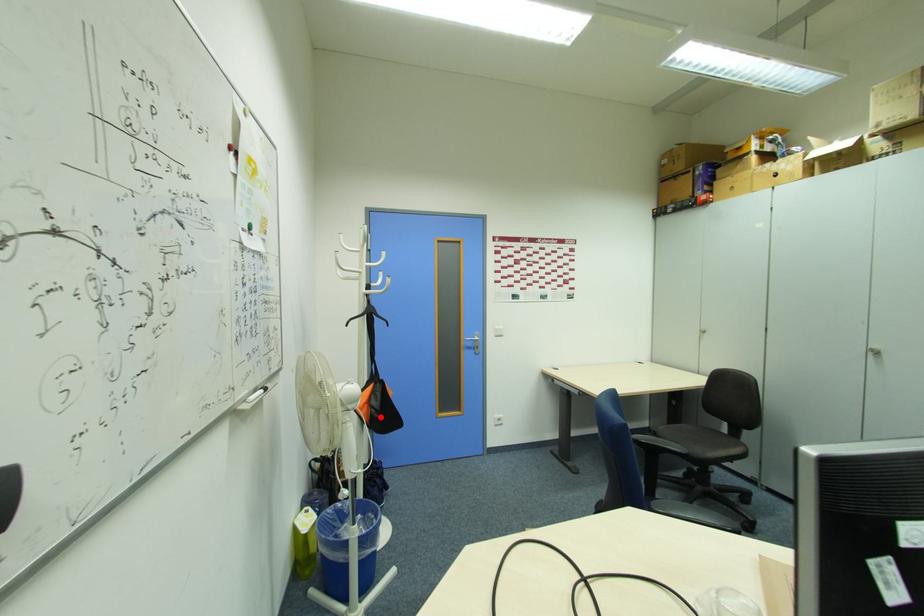
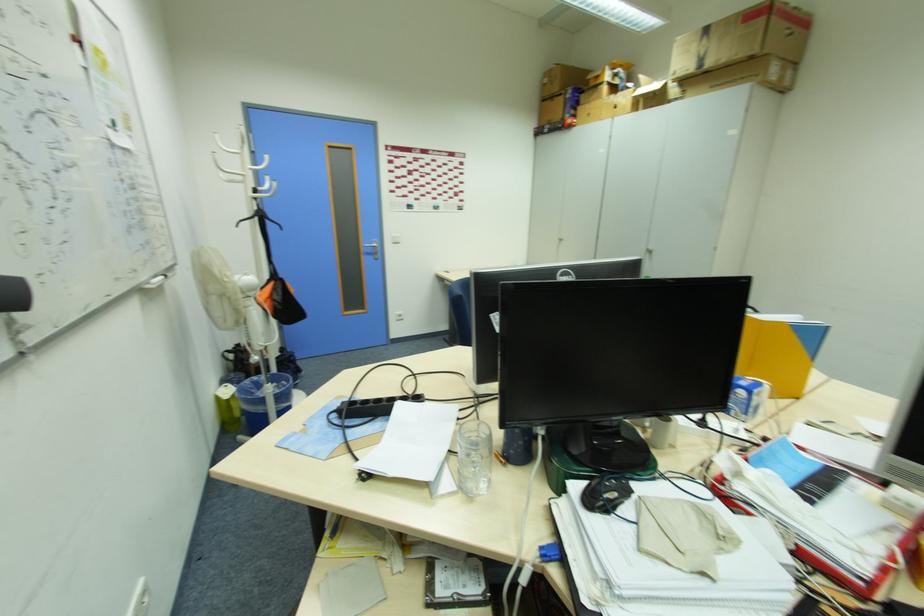
Find the pixel in the second image that matches the highlighted location in the first image.

(283, 309)